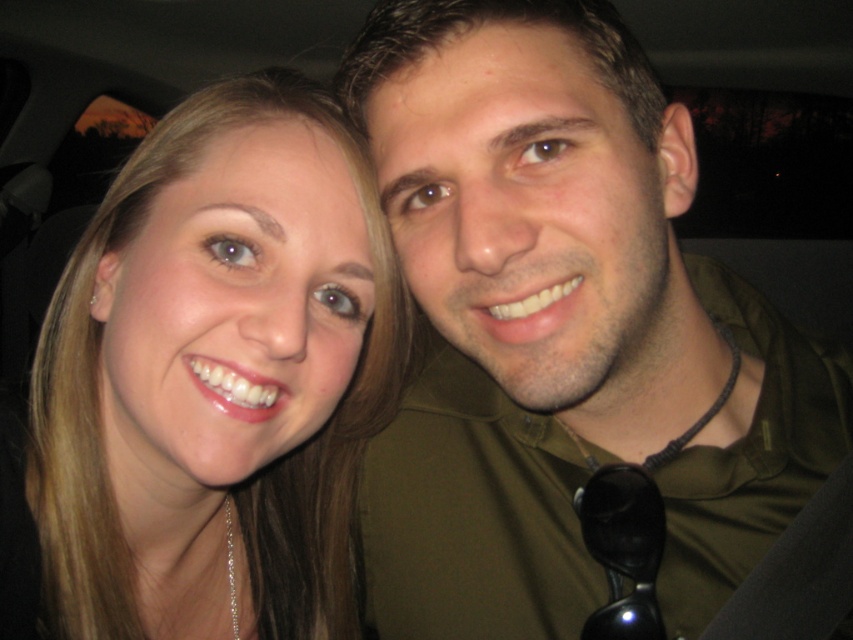
Question: Does matte green shirt at center have a larger size compared to matte gold necklace at left?

Choices:
 (A) yes
 (B) no

Answer: (B)

Question: Is matte green shirt at center bigger than matte gold necklace at left?

Choices:
 (A) yes
 (B) no

Answer: (B)

Question: Which point is closer to the camera taking this photo?

Choices:
 (A) (486, 540)
 (B) (155, 172)

Answer: (B)

Question: Does matte green shirt at center have a larger size compared to matte gold necklace at left?

Choices:
 (A) yes
 (B) no

Answer: (B)